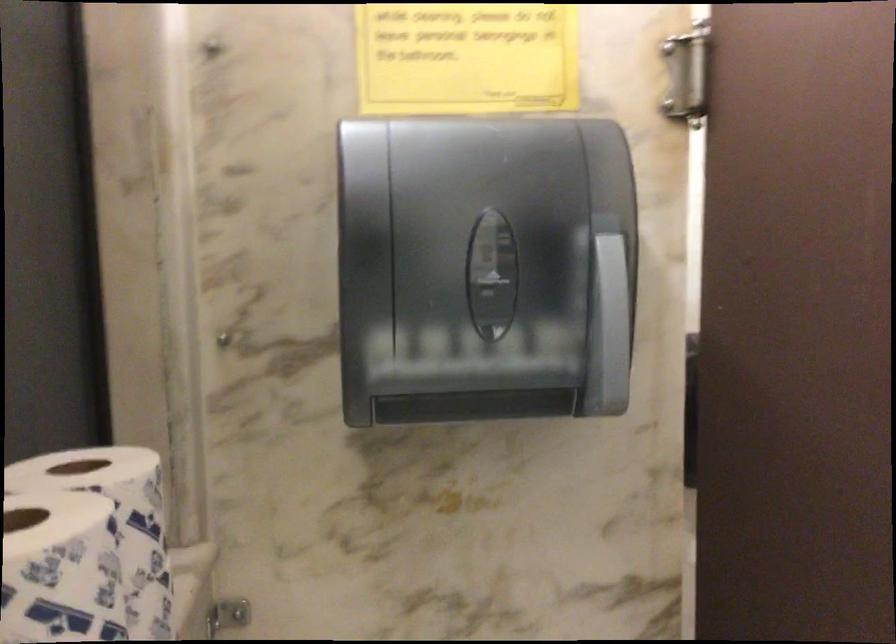
Describe the element at coordinates (687, 73) in the screenshot. I see `the door handle` at that location.